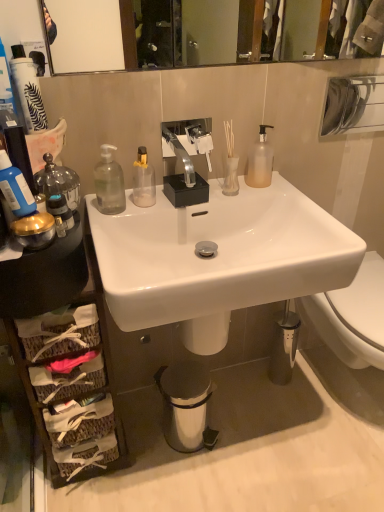
Identify the location of free region under metallic trash can at lower center (from a real-world perspective). The height and width of the screenshot is (512, 384). (190, 437).